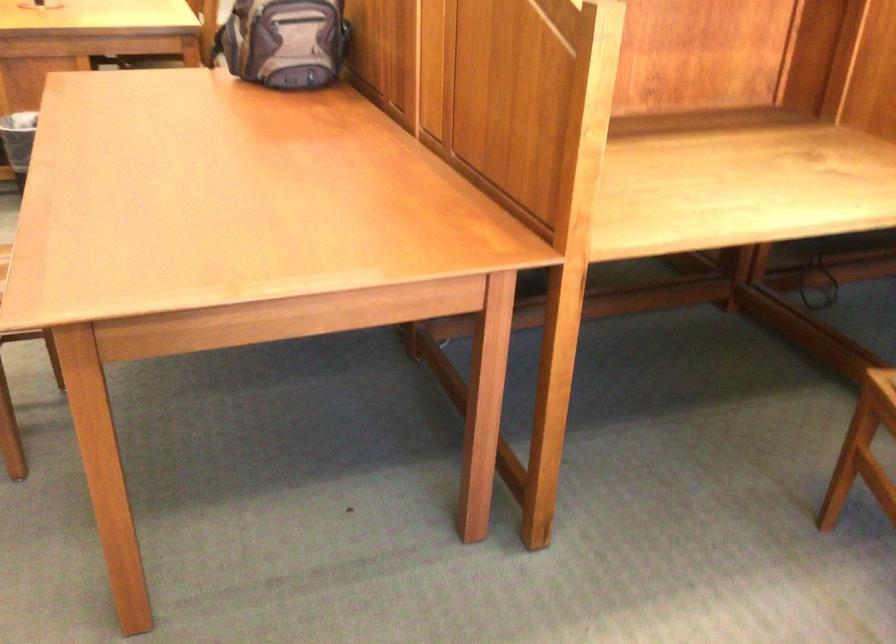
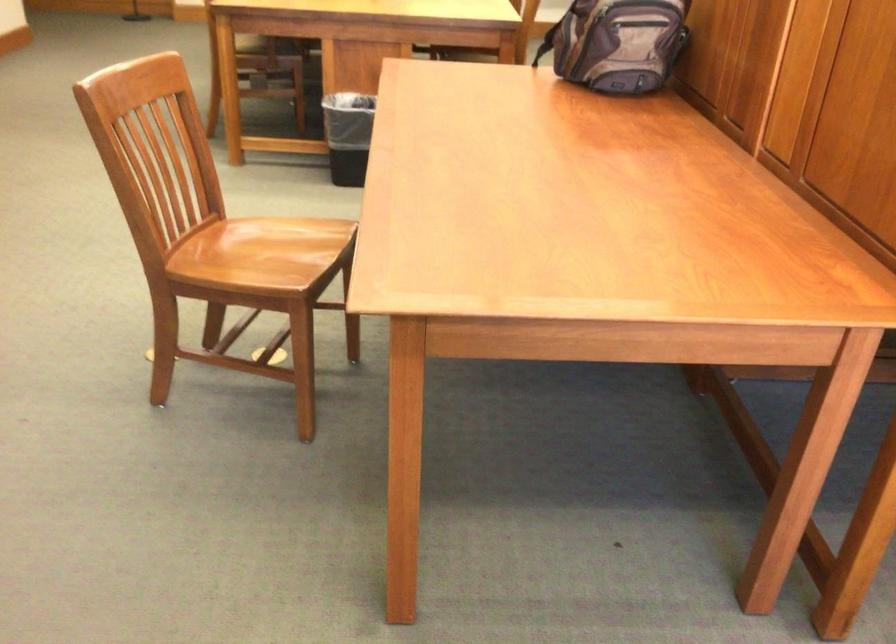
The images are taken continuously from a first-person perspective. In which direction are you moving?

The movement direction of the cameraman is left, forward.